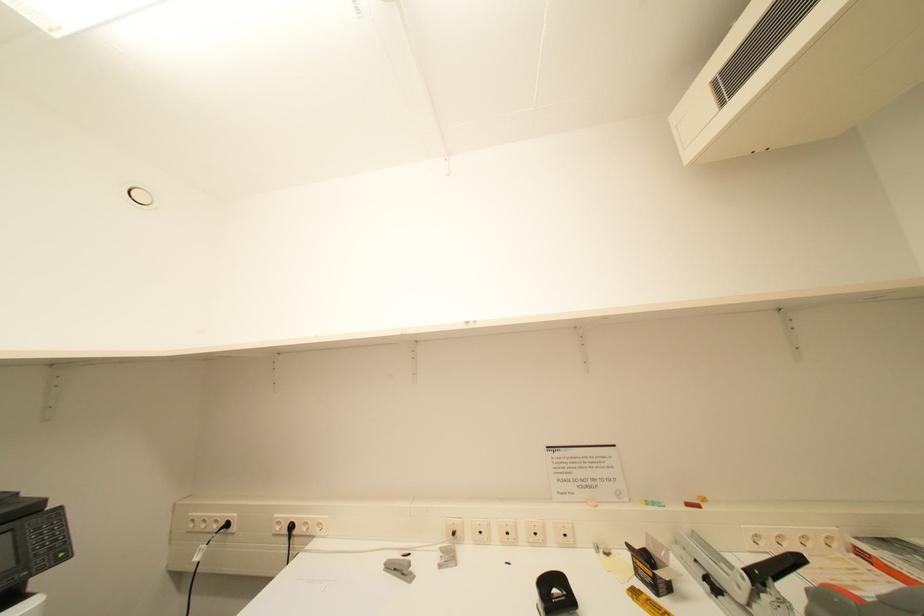
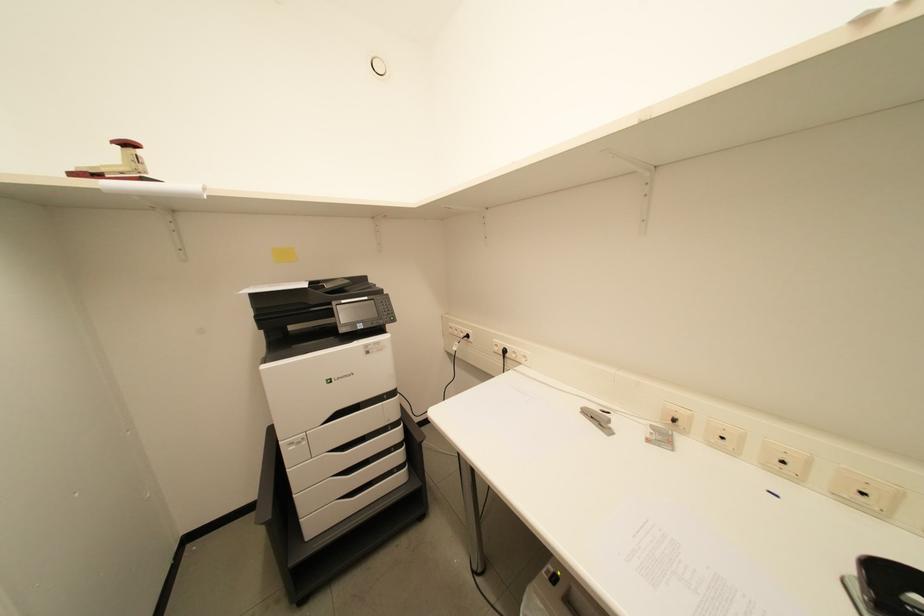
The images are taken continuously from a first-person perspective. In which direction is your viewpoint rotating?

The rotation direction of the camera is left-down.